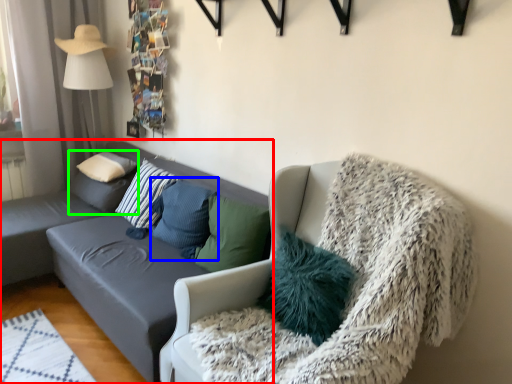
Question: Which object is positioned farthest from studio couch (highlighted by a red box)? Select from pillow (highlighted by a blue box) and pillow (highlighted by a green box).

Choices:
 (A) pillow
 (B) pillow

Answer: (B)